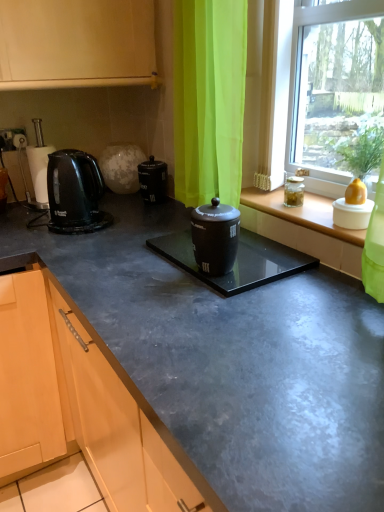
Question: Is transparent glass window at center thinner than black plastic kettle at left?

Choices:
 (A) no
 (B) yes

Answer: (A)

Question: Can you confirm if transparent glass window at center is wider than black plastic kettle at left?

Choices:
 (A) no
 (B) yes

Answer: (B)

Question: Is transparent glass window at center bigger than black plastic kettle at left?

Choices:
 (A) yes
 (B) no

Answer: (A)

Question: Does transparent glass window at center turn towards black plastic kettle at left?

Choices:
 (A) no
 (B) yes

Answer: (A)

Question: From a real-world perspective, is transparent glass window at center physically below black plastic kettle at left?

Choices:
 (A) yes
 (B) no

Answer: (B)

Question: Is point (347, 234) positioned closer to the camera than point (46, 181)?

Choices:
 (A) closer
 (B) farther

Answer: (A)

Question: From a real-world perspective, is matte glass window sill at center positioned above or below black plastic kettle at left?

Choices:
 (A) above
 (B) below

Answer: (B)

Question: Considering their positions, is matte glass window sill at center located in front of or behind black plastic kettle at left?

Choices:
 (A) front
 (B) behind

Answer: (A)

Question: Is matte glass window sill at center wider or thinner than black plastic kettle at left?

Choices:
 (A) thin
 (B) wide

Answer: (B)

Question: Visually, is black glossy electric kettle at left positioned to the left or to the right of black glossy container at center?

Choices:
 (A) left
 (B) right

Answer: (A)

Question: From the image's perspective, is black glossy electric kettle at left positioned above or below black glossy container at center?

Choices:
 (A) above
 (B) below

Answer: (A)

Question: Considering the positions of black glossy electric kettle at left and black glossy container at center in the image, is black glossy electric kettle at left bigger or smaller than black glossy container at center?

Choices:
 (A) small
 (B) big

Answer: (B)

Question: In terms of height, does black glossy electric kettle at left look taller or shorter compared to black glossy container at center?

Choices:
 (A) short
 (B) tall

Answer: (B)

Question: Looking at their shapes, would you say matte black coffee canister at center is wider or thinner than black glossy container at center?

Choices:
 (A) thin
 (B) wide

Answer: (B)

Question: Considering their positions, is matte black coffee canister at center located in front of or behind black glossy container at center?

Choices:
 (A) front
 (B) behind

Answer: (B)